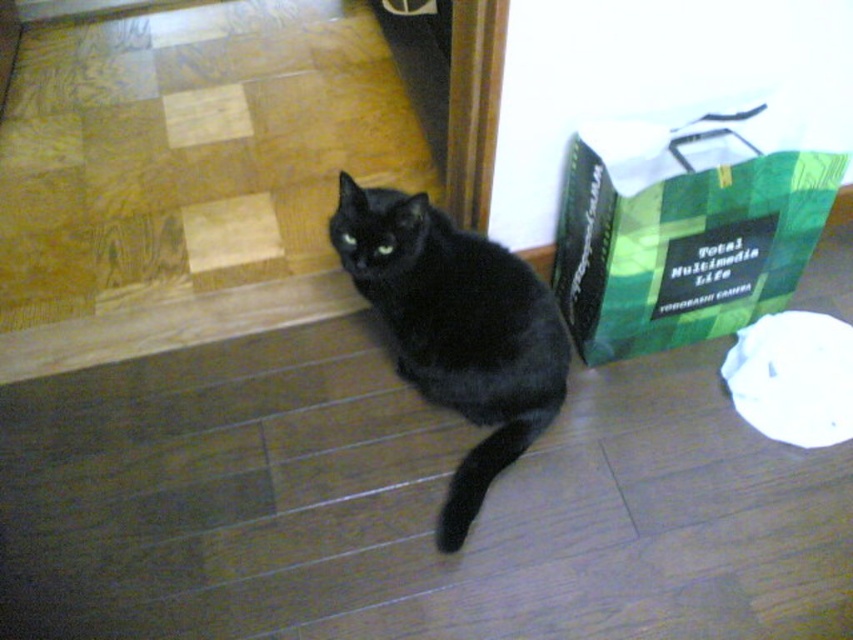
Question: Which point appears closest to the camera in this image?

Choices:
 (A) 583,317
 (B) 473,401

Answer: (B)

Question: Is green paper shopping bag at right bigger than black fur cat at center?

Choices:
 (A) yes
 (B) no

Answer: (B)

Question: Can you confirm if green paper shopping bag at right is bigger than black fur cat at center?

Choices:
 (A) no
 (B) yes

Answer: (A)

Question: Which of the following is the closest to the observer?

Choices:
 (A) (392, 304)
 (B) (605, 188)

Answer: (B)

Question: Is green paper shopping bag at right bigger than black fur cat at center?

Choices:
 (A) no
 (B) yes

Answer: (A)

Question: Which point is closer to the camera taking this photo?

Choices:
 (A) (498, 332)
 (B) (810, 172)

Answer: (A)